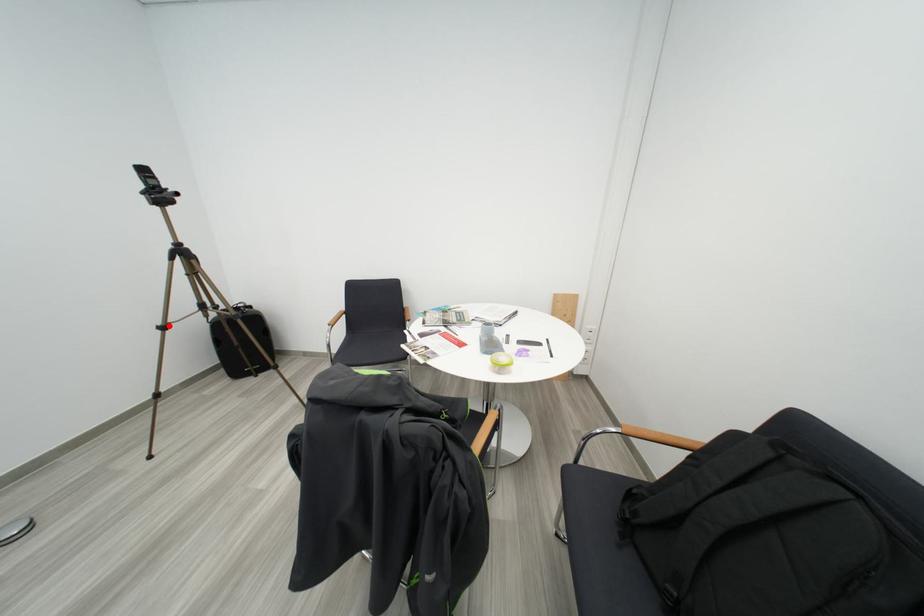
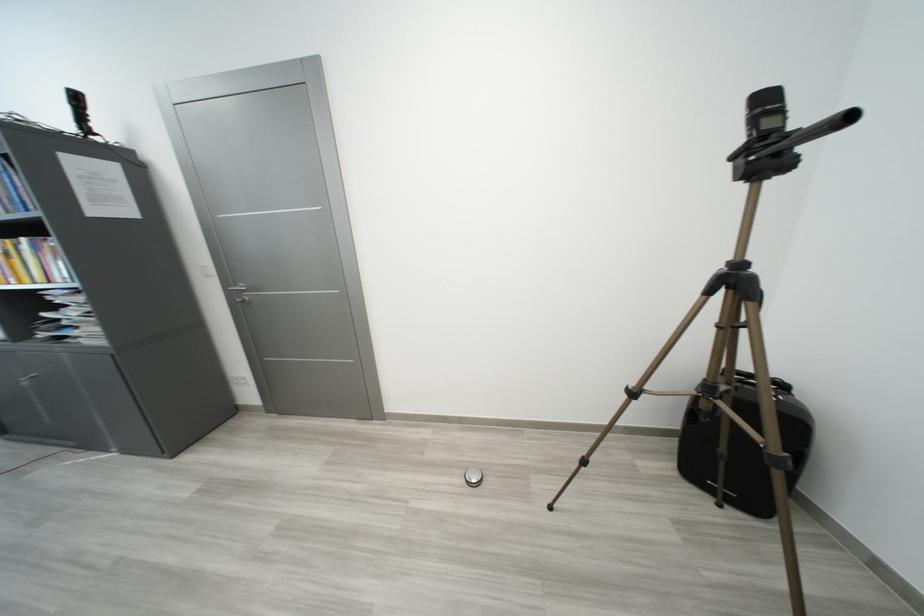
Locate, in the second image, the point that corresponds to the highlighted location in the first image.

(640, 387)